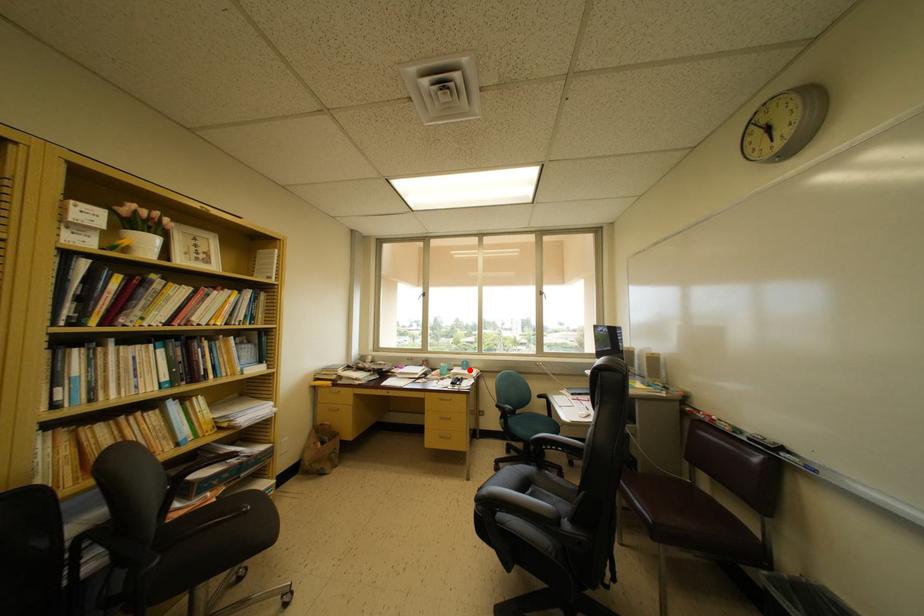
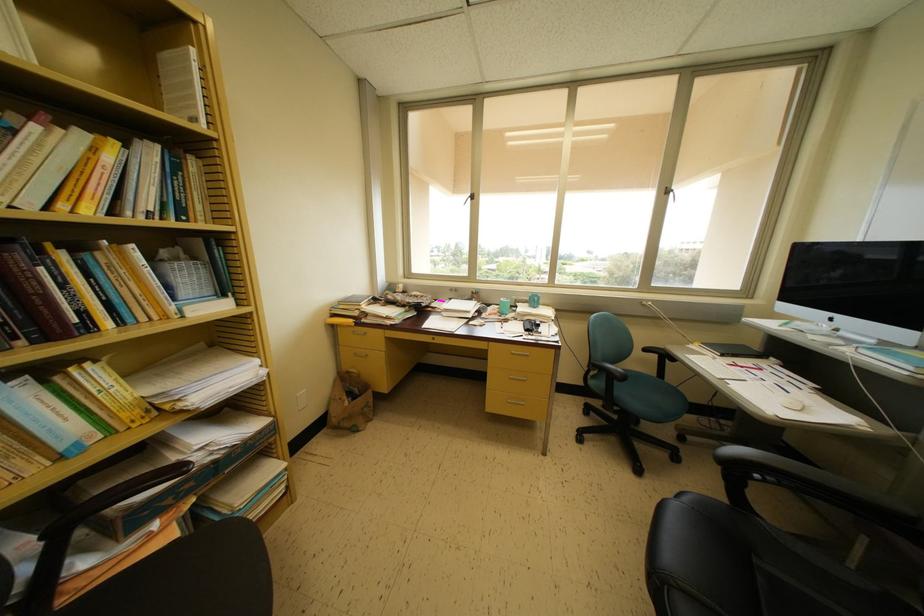
The point at the highlighted location is marked in the first image. Where is the corresponding point in the second image?

(538, 306)